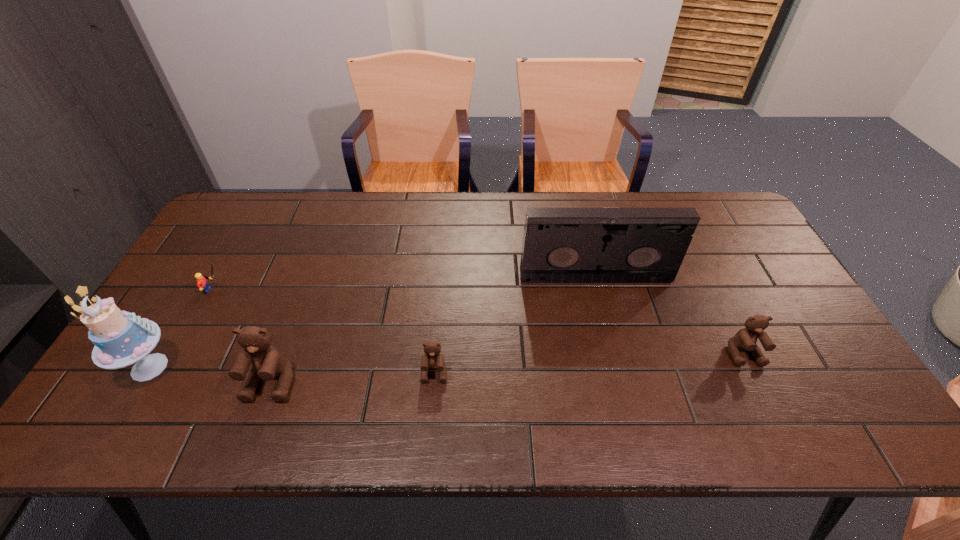
The width and height of the screenshot is (960, 540). Find the location of `vacant area that lies between the fifth nearest object and the third object from right to left`. vacant area that lies between the fifth nearest object and the third object from right to left is located at coordinates (324, 332).

Where is `free area in between the third object from right to left and the videotape`? The width and height of the screenshot is (960, 540). free area in between the third object from right to left and the videotape is located at coordinates (515, 325).

Identify the location of the third closest object relative to the second farthest object. (432, 359).

Find the location of `the fifth closest object relative to the shortest teddy bear`. the fifth closest object relative to the shortest teddy bear is located at coordinates (745, 339).

Identify which teddy bear is the third nearest to the farthest object. Please provide its 2D coordinates. Your answer should be formatted as a tuple, i.e. [(x, y)], where the tuple contains the x and y coordinates of a point satisfying the conditions above.

[(267, 362)]

Find the location of a particular element. Image resolution: width=960 pixels, height=540 pixels. the second closest teddy bear to the leftmost teddy bear is located at coordinates (745, 339).